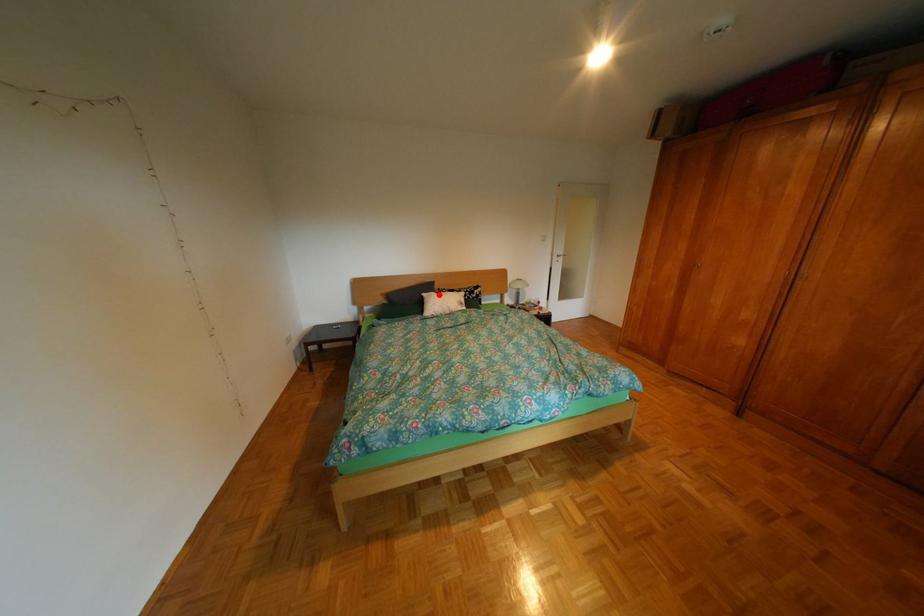
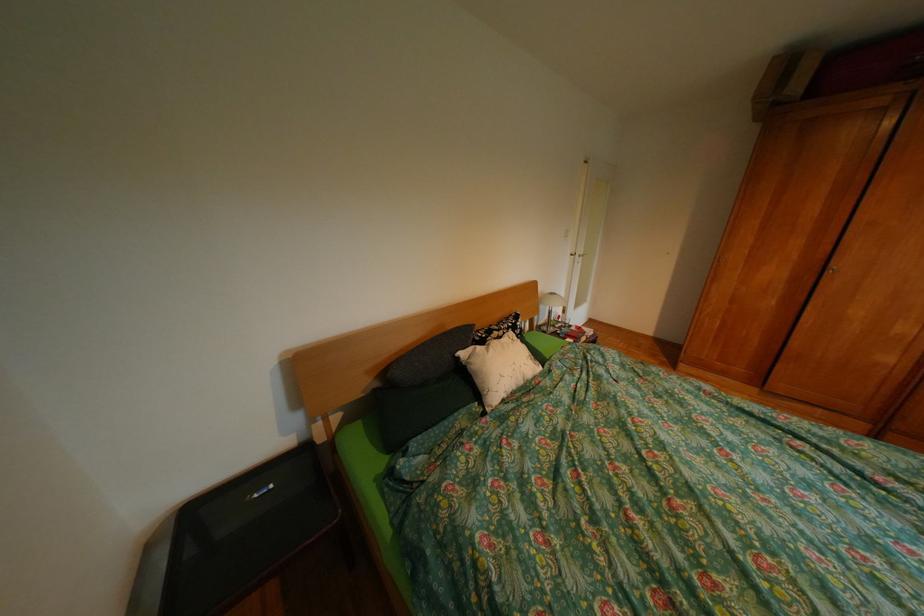
In the second image, find the point that corresponds to the highlighted location in the first image.

(477, 354)